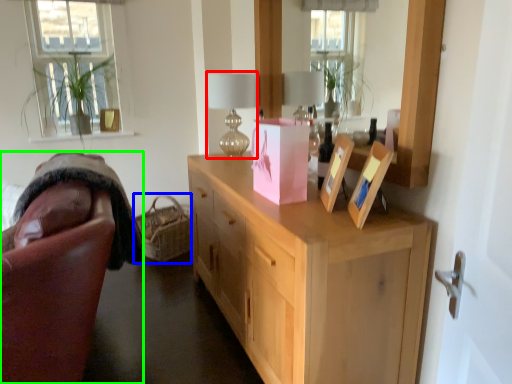
Question: Which object is positioned farthest from table lamp (highlighted by a red box)? Select from basket (highlighted by a blue box) and chair (highlighted by a green box).

Choices:
 (A) basket
 (B) chair

Answer: (A)